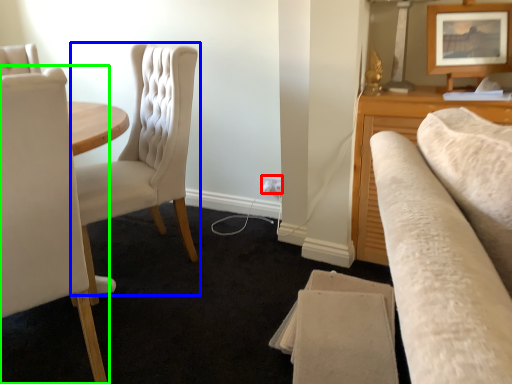
Question: Based on their relative distances, which object is farther from electric outlet (highlighted by a red box)? Choose from chair (highlighted by a blue box) and chair (highlighted by a green box).

Choices:
 (A) chair
 (B) chair

Answer: (B)